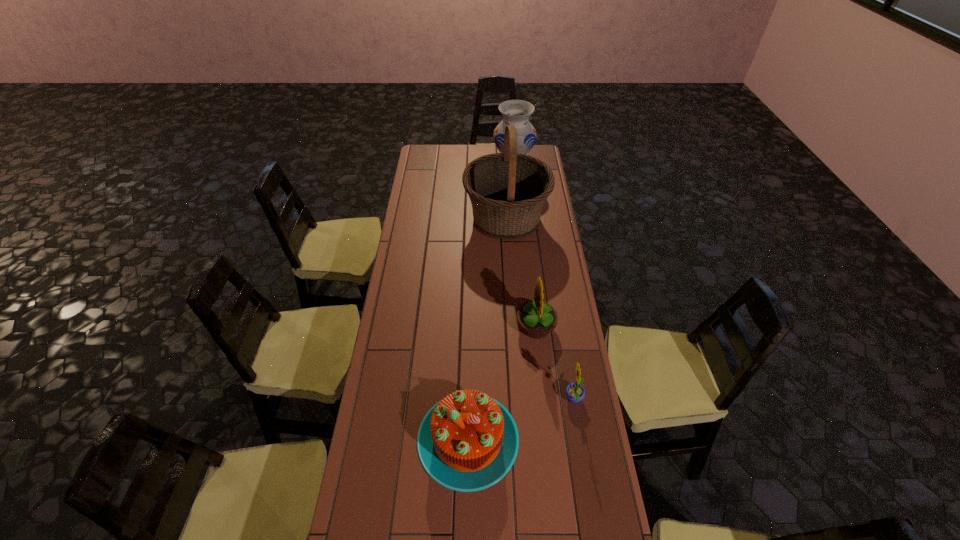
At what (x,y) coordinates should I click in order to perform the action: click on object that is positioned at the far right corner. Please return your answer as a coordinate pair (x, y). Looking at the image, I should click on (515, 112).

This screenshot has width=960, height=540. What are the coordinates of `vacant area at the left edge` in the screenshot? It's located at (420, 228).

This screenshot has width=960, height=540. I want to click on free spot at the right edge of the desktop, so click(x=547, y=202).

Where is `vacant space at the far right corner of the desktop`? This screenshot has width=960, height=540. vacant space at the far right corner of the desktop is located at coordinates (539, 153).

Image resolution: width=960 pixels, height=540 pixels. I want to click on empty location between the nearer sunflower and the third shortest object, so click(555, 363).

This screenshot has width=960, height=540. I want to click on empty space that is in between the cake and the vase, so click(491, 301).

Where is `vacant region between the cake and the shorter sunflower`? vacant region between the cake and the shorter sunflower is located at coordinates (521, 419).

Locate which object ranks fourth in proximity to the second farthest object. Please provide its 2D coordinates. Your answer should be formatted as a tuple, i.e. [(x, y)], where the tuple contains the x and y coordinates of a point satisfying the conditions above.

[(468, 441)]

This screenshot has width=960, height=540. In order to click on object that is the nearest to the fourth shortest object in this screenshot , I will do `click(508, 190)`.

This screenshot has width=960, height=540. Identify the location of vacant space that satisfies the following two spatial constraints: 1. on the back side of the tallest object; 2. on the right side of the cake. (472, 219).